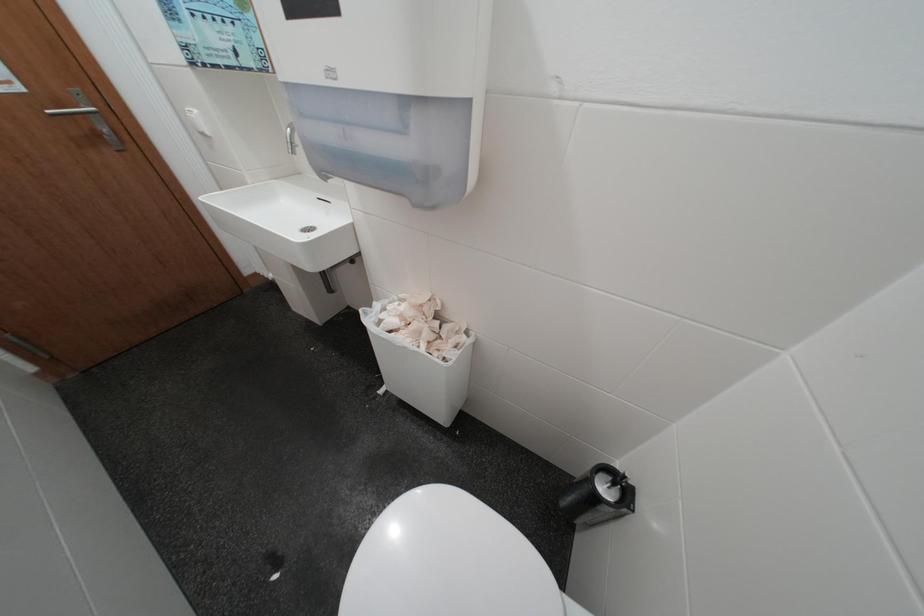
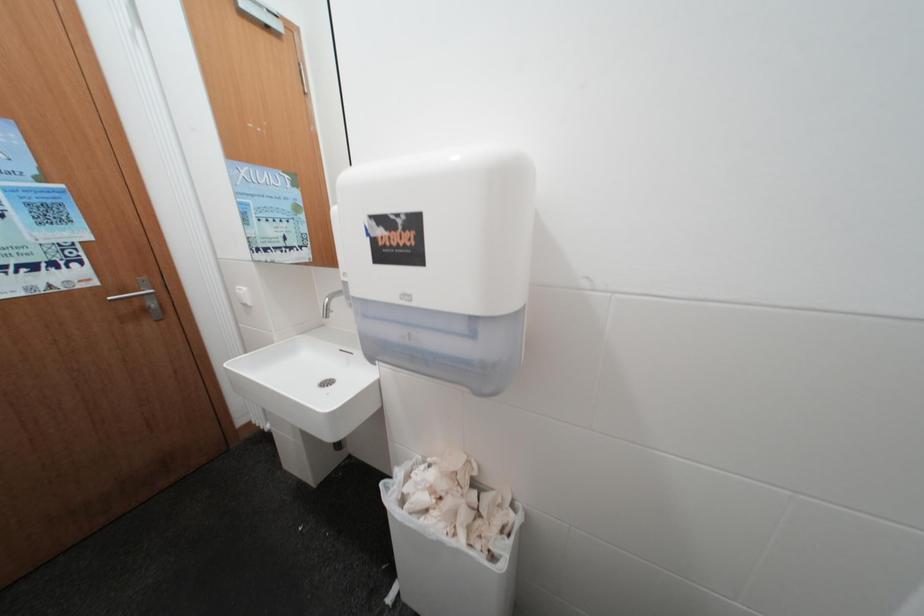
Question: Based on the continuous images, in which direction is the camera rotating? Reply with the corresponding letter.

Choices:
 (A) Left
 (B) Right
 (C) Up
 (D) Down

Answer: (C)